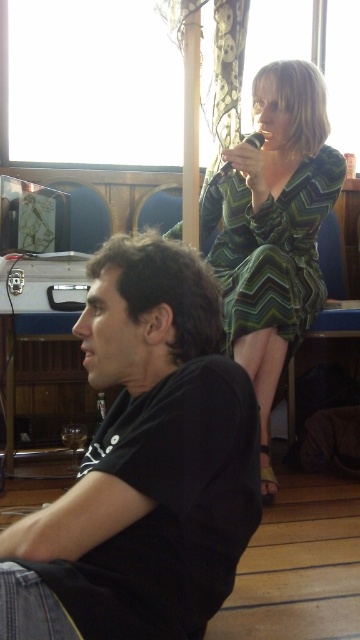
Question: Does black matte shirt at lower left have a lesser width compared to green zigzag dress at upper right?

Choices:
 (A) yes
 (B) no

Answer: (A)

Question: Considering the relative positions of black matte shirt at lower left and green zigzag dress at upper right in the image provided, where is black matte shirt at lower left located with respect to green zigzag dress at upper right?

Choices:
 (A) above
 (B) below

Answer: (B)

Question: Among these objects, which one is farthest from the camera?

Choices:
 (A) green zigzag dress at upper right
 (B) black matte shirt at lower left

Answer: (A)

Question: Observing the image, what is the correct spatial positioning of black matte shirt at lower left in reference to green zigzag dress at upper right?

Choices:
 (A) right
 (B) left

Answer: (B)